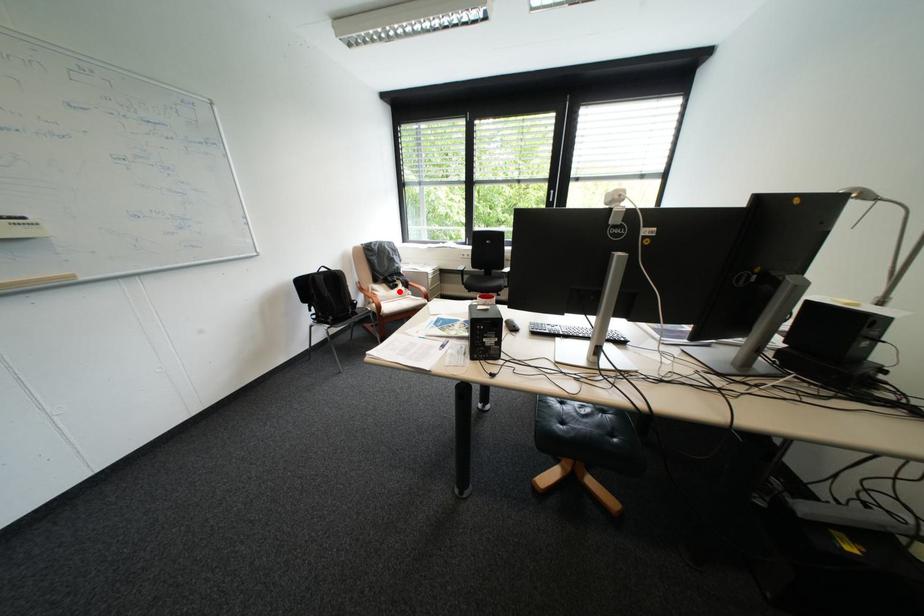
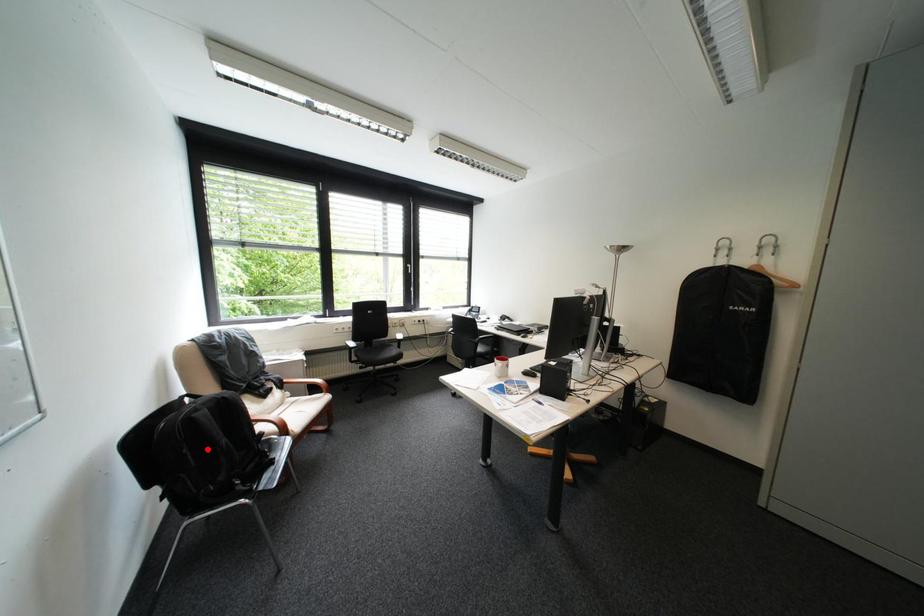
I am providing you with two images of the same scene from different viewpoints. A red point is marked on the first image and another point is marked on the second image. Do the highlighted points in image1 and image2 indicate the same real-world spot?

No